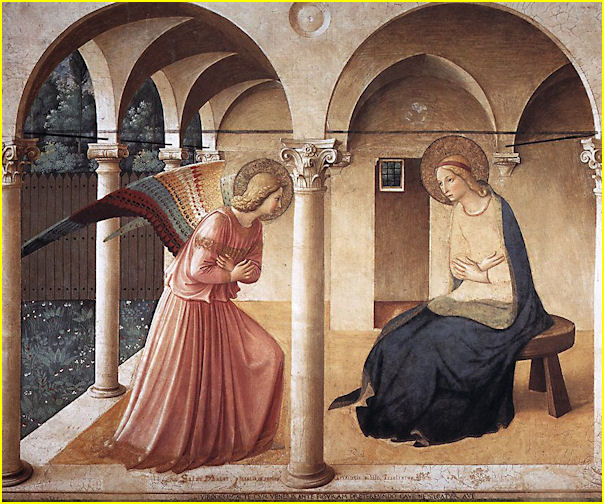
The width and height of the screenshot is (604, 504). What are the coordinates of `floor` in the screenshot? It's located at click(x=341, y=351).